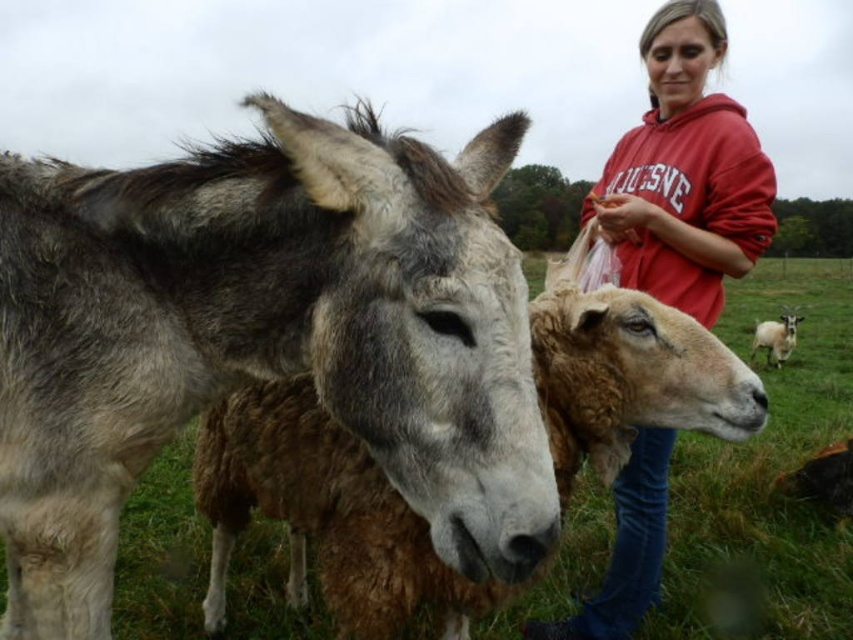
Question: Where is gray fuzzy donkey at left located in relation to red cotton hoodie at upper right in the image?

Choices:
 (A) above
 (B) below

Answer: (B)

Question: Considering the real-world distances, which object is closest to the brown woolen sheep at center?

Choices:
 (A) red cotton hoodie at upper right
 (B) gray fuzzy donkey at left
 (C) brown woolen sheep at right

Answer: (B)

Question: Can you confirm if gray fuzzy donkey at left is positioned above brown woolen sheep at center?

Choices:
 (A) no
 (B) yes

Answer: (B)

Question: Which object is closer to the camera taking this photo?

Choices:
 (A) brown woolen sheep at center
 (B) brown woolen sheep at right
 (C) red cotton hoodie at upper right

Answer: (A)

Question: Which point is closer to the camera taking this photo?

Choices:
 (A) (608, 205)
 (B) (7, 362)
 (C) (764, 337)
 (D) (543, 323)

Answer: (B)

Question: Is gray fuzzy donkey at left in front of brown woolen sheep at right?

Choices:
 (A) yes
 (B) no

Answer: (A)